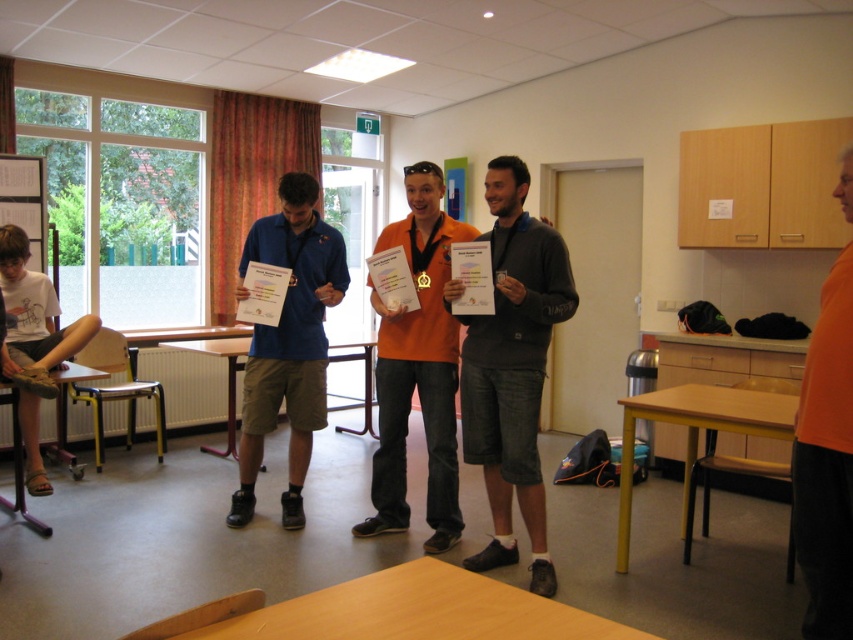
Question: Can you confirm if orange matte shirt at center is smaller than metallic silver bulletin board at upper left?

Choices:
 (A) yes
 (B) no

Answer: (B)

Question: Which point appears farthest from the camera in this image?

Choices:
 (A) [28, 192]
 (B) [527, 301]
 (C) [300, 209]
 (D) [820, 342]

Answer: (A)

Question: Is dark gray cotton shorts at center further to the viewer compared to blue fabric shirt at center?

Choices:
 (A) no
 (B) yes

Answer: (A)

Question: Among these objects, which one is nearest to the camera?

Choices:
 (A) orange matte shirt at center
 (B) blue fabric shirt at center
 (C) dark gray cotton shorts at center
 (D) metallic silver bulletin board at upper left

Answer: (A)

Question: Is orange matte shirt at center above metallic silver bulletin board at upper left?

Choices:
 (A) no
 (B) yes

Answer: (A)

Question: Which object is positioned closest to the dark gray cotton shorts at center?

Choices:
 (A) orange matte shirt at center
 (B) metallic silver bulletin board at upper left

Answer: (A)